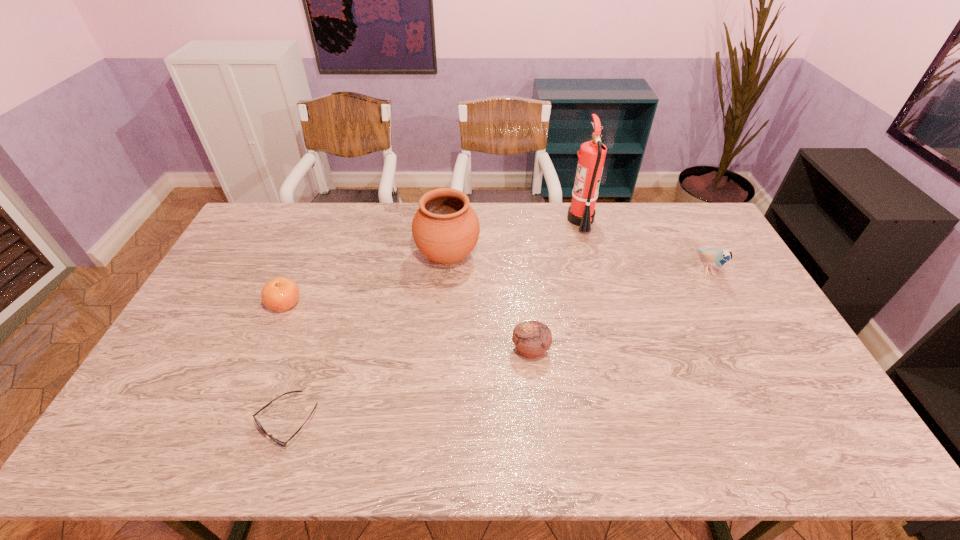
Identify the location of the nearest object. (284, 444).

Find the location of a particular element. sunglasses is located at coordinates (284, 444).

I want to click on free space located at the nozzle of the second object from right to left, so click(484, 220).

What are the coordinates of `vacant point located 0.340m at the nozzle of the second object from right to left` in the screenshot? It's located at (479, 220).

What are the coordinates of `vacant space situated 0.230m at the nozzle of the second object from right to left` in the screenshot? It's located at (508, 220).

Identify the location of vacant space located on the back of the second tallest object. The width and height of the screenshot is (960, 540). (450, 226).

In order to click on vacant space located 0.110m at the face of the bird in this screenshot , I will do [731, 313].

Find the location of a particular element. vacant position located on the back of the fifth farthest object is located at coordinates (527, 319).

The image size is (960, 540). What are the coordinates of `vacant area situated 0.080m on the front of the fourth farthest object` in the screenshot? It's located at (270, 338).

Identify the location of fire extinguisher present at the far edge. Image resolution: width=960 pixels, height=540 pixels. (592, 154).